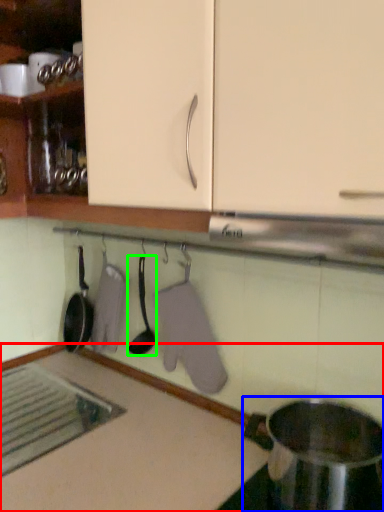
Question: Estimate the real-world distances between objects in this image. Which object is closer to countertop (highlighted by a red box), appliance (highlighted by a blue box) or spoon (highlighted by a green box)?

Choices:
 (A) appliance
 (B) spoon

Answer: (A)